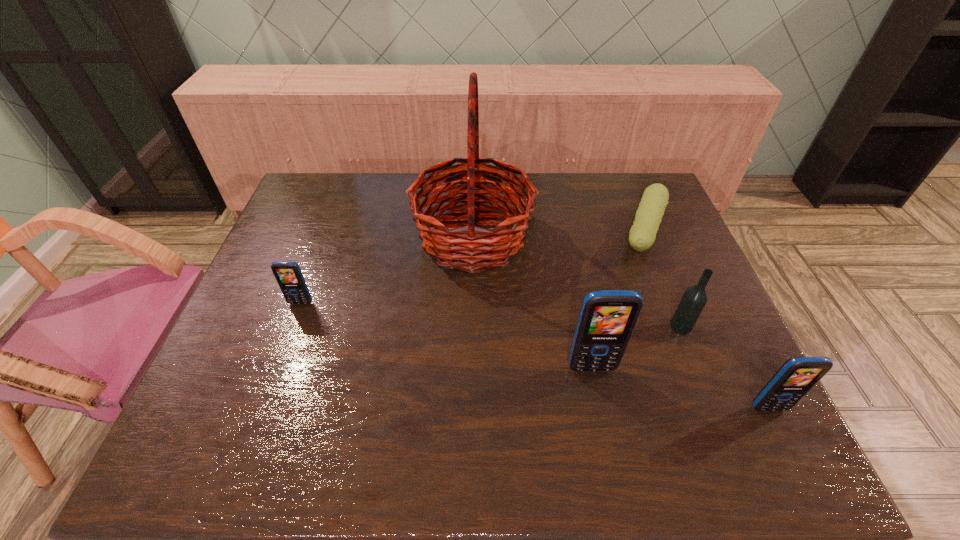
Locate an element on the screen. vodka present at the right edge is located at coordinates (694, 299).

The height and width of the screenshot is (540, 960). In order to click on object at the far right corner in this screenshot , I will do `click(642, 235)`.

This screenshot has width=960, height=540. I want to click on object that is at the near right corner, so click(x=797, y=375).

In the image, there is a desktop. At what (x,y) coordinates should I click in order to perform the action: click on free region at the far edge. Please return your answer as a coordinate pair (x, y). The image size is (960, 540). Looking at the image, I should click on (361, 176).

At what (x,y) coordinates should I click in order to perform the action: click on vacant position at the near edge of the desktop. Please return your answer as a coordinate pair (x, y). Image resolution: width=960 pixels, height=540 pixels. Looking at the image, I should click on (587, 396).

Find the location of `free space at the left edge of the desktop`. free space at the left edge of the desktop is located at coordinates point(312,233).

You are a GUI agent. You are given a task and a screenshot of the screen. Output one action in this format:
    pyautogui.click(x=<x>, y=<y>)
    Task: Click on the free space at the right edge of the desktop
    
    Given the screenshot: What is the action you would take?
    721,370

Locate an element on the screen. vacant space at the far left corner of the desktop is located at coordinates (310, 179).

Where is `vacant space at the far right corner of the desktop`? This screenshot has width=960, height=540. vacant space at the far right corner of the desktop is located at coordinates (625, 215).

Find the location of a particular element. vacant space in between the nearest object and the fifth farthest object is located at coordinates (680, 388).